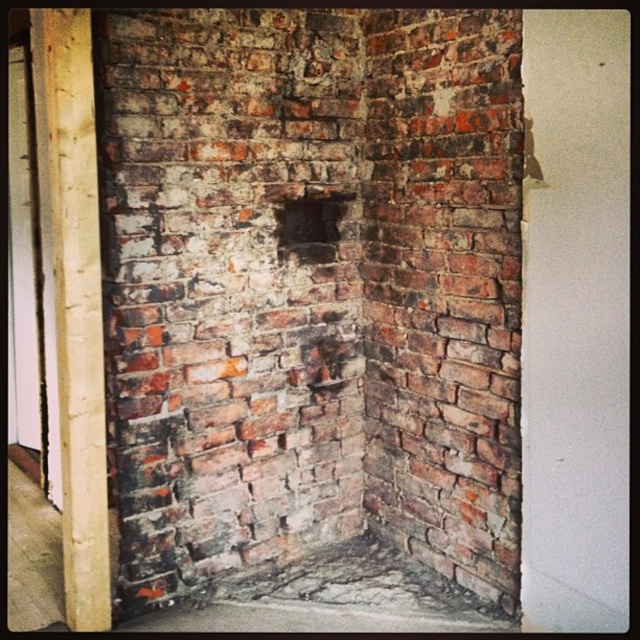
Can you confirm if weathered brick at center is shorter than dark brick hole at center?

In fact, weathered brick at center may be taller than dark brick hole at center.

This screenshot has width=640, height=640. In order to click on weathered brick at center in this screenshot , I will do `click(310, 298)`.